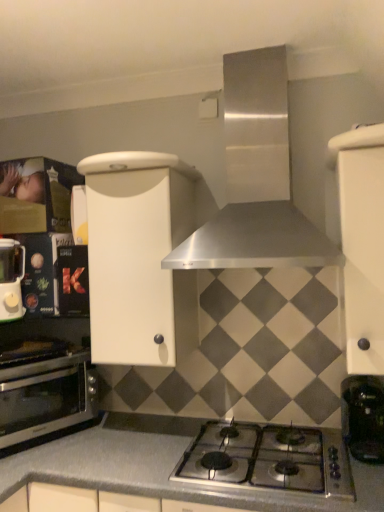
Question: Does white matte cabinet at center, which is counted as the first cabinetry, starting from the left, have a lesser width compared to polished stainless steel gas stove at center?

Choices:
 (A) no
 (B) yes

Answer: (B)

Question: From the image's perspective, does white matte cabinet at center, acting as the 2th cabinetry starting from the right, appear lower than polished stainless steel gas stove at center?

Choices:
 (A) yes
 (B) no

Answer: (B)

Question: Does white matte cabinet at center, acting as the 2th cabinetry starting from the right, have a smaller size compared to polished stainless steel gas stove at center?

Choices:
 (A) no
 (B) yes

Answer: (A)

Question: From a real-world perspective, is white matte cabinet at center, which is counted as the first cabinetry, starting from the left, physically above polished stainless steel gas stove at center?

Choices:
 (A) yes
 (B) no

Answer: (A)

Question: Is white matte cabinet at center, which is counted as the first cabinetry, starting from the left, looking in the opposite direction of polished stainless steel gas stove at center?

Choices:
 (A) no
 (B) yes

Answer: (A)

Question: Considering the relative sizes of white matte cabinet at center, which is counted as the first cabinetry, starting from the left, and polished stainless steel gas stove at center in the image provided, is white matte cabinet at center, which is counted as the first cabinetry, starting from the left, wider than polished stainless steel gas stove at center?

Choices:
 (A) yes
 (B) no

Answer: (B)

Question: Is matte white blender at left looking in the opposite direction of polished stainless steel gas stove at center?

Choices:
 (A) yes
 (B) no

Answer: (B)

Question: Does matte white blender at left turn towards polished stainless steel gas stove at center?

Choices:
 (A) no
 (B) yes

Answer: (A)

Question: From the image's perspective, is matte white blender at left beneath polished stainless steel gas stove at center?

Choices:
 (A) no
 (B) yes

Answer: (A)

Question: From a real-world perspective, is matte white blender at left physically above polished stainless steel gas stove at center?

Choices:
 (A) yes
 (B) no

Answer: (A)

Question: Can you confirm if matte white blender at left is wider than polished stainless steel gas stove at center?

Choices:
 (A) yes
 (B) no

Answer: (B)

Question: Is matte white blender at left closer to the viewer compared to polished stainless steel gas stove at center?

Choices:
 (A) yes
 (B) no

Answer: (B)

Question: Is stainless steel oven at lower left smaller than stainless steel range hood at upper center?

Choices:
 (A) yes
 (B) no

Answer: (A)